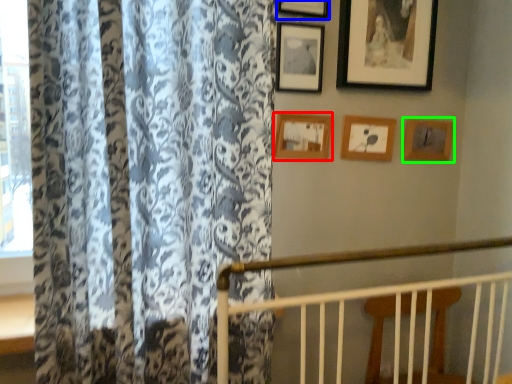
Question: Considering the real-world distances, which object is closest to picture frame (highlighted by a red box)? picture frame (highlighted by a blue box) or picture frame (highlighted by a green box).

Choices:
 (A) picture frame
 (B) picture frame

Answer: (A)